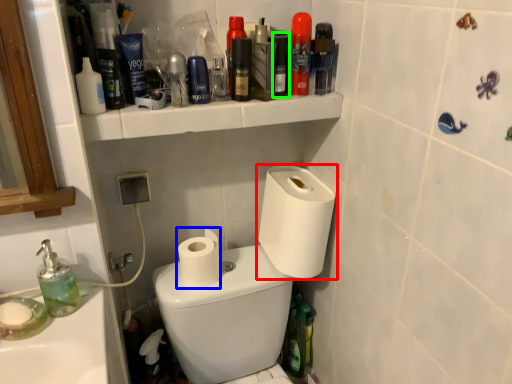
Question: Which object is positioned closest to toilet paper (highlighted by a red box)? Select from toilet paper (highlighted by a blue box) and mouthwash (highlighted by a green box).

Choices:
 (A) toilet paper
 (B) mouthwash

Answer: (A)